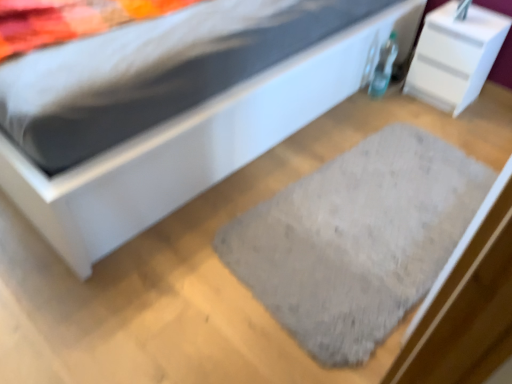
Question: In terms of width, does white glossy nightstand at upper right look wider or thinner when compared to white matte bed at center?

Choices:
 (A) thin
 (B) wide

Answer: (A)

Question: Would you say white glossy nightstand at upper right is to the left or to the right of white matte bed at center in the picture?

Choices:
 (A) left
 (B) right

Answer: (B)

Question: Estimate the real-world distances between objects in this image. Which object is closer to the white glossy nightstand at upper right?

Choices:
 (A) gray fuzzy rug at center
 (B) white matte bed at center

Answer: (B)

Question: Which object is the farthest from the white matte bed at center?

Choices:
 (A) white glossy nightstand at upper right
 (B) gray fuzzy rug at center

Answer: (A)